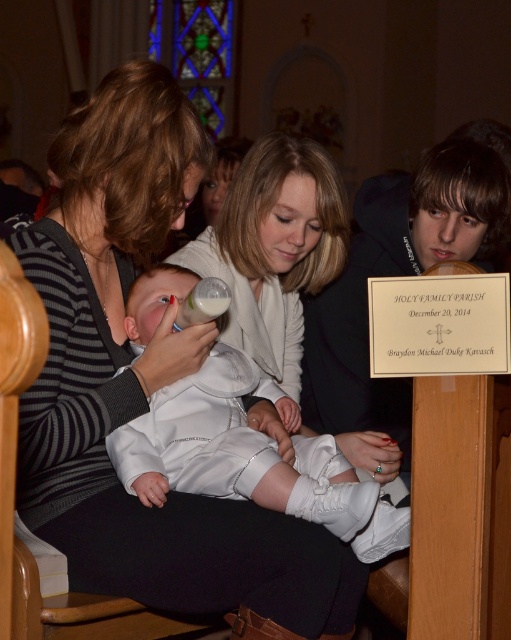
Does point (141, 541) come closer to viewer compared to point (243, 432)?

Yes, it is in front of point (243, 432).

Is point (96, 490) positioned behind point (150, 451)?

Yes.

This screenshot has height=640, width=511. Find the location of `striped sweater at center`. striped sweater at center is located at coordinates (144, 385).

In the scene shown: Is striped sweater at center below white plastic bottle at center?

Correct, striped sweater at center is located below white plastic bottle at center.

Based on the photo, does striped sweater at center appear on the right side of white plastic bottle at center?

In fact, striped sweater at center is to the left of white plastic bottle at center.

Where is `striped sweater at center`? The height and width of the screenshot is (640, 511). striped sweater at center is located at coordinates (144, 385).

Who is higher up, white satin baby at center or white plastic bottle at center?

Positioned higher is white plastic bottle at center.

Does white satin baby at center come behind white plastic bottle at center?

No.

Is point (208, 429) positioned behind point (206, 298)?

That is True.

Locate an element on the screen. The height and width of the screenshot is (640, 511). white satin baby at center is located at coordinates (249, 458).